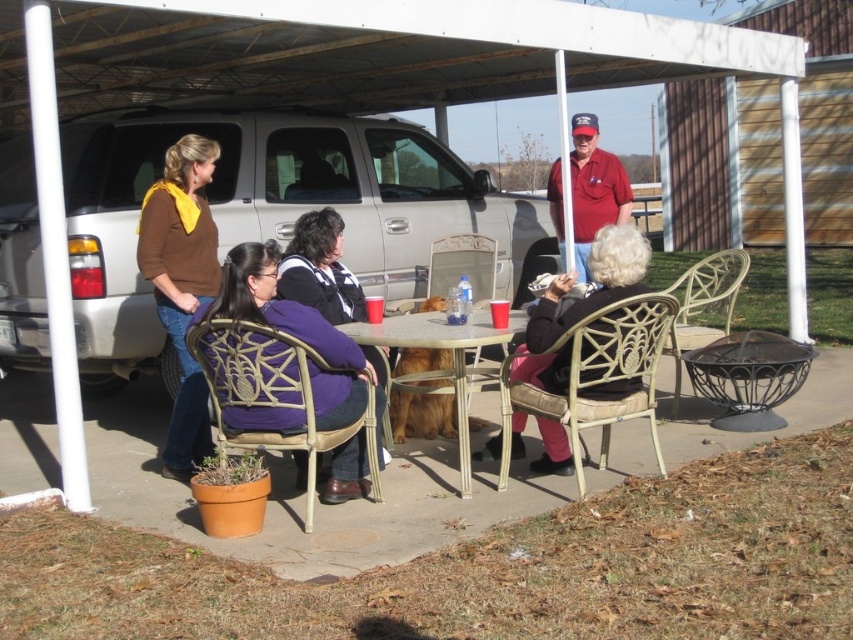
Question: Which point appears closest to the camera in this image?

Choices:
 (A) (279, 262)
 (B) (637, 376)

Answer: (B)

Question: Does metallic gold chair at center have a greater width compared to red cotton shirt at center?

Choices:
 (A) yes
 (B) no

Answer: (A)

Question: Which of these objects is positioned farthest from the metallic gold chair at right?

Choices:
 (A) silver metallic suv at center
 (B) purple sweater at center

Answer: (A)

Question: Is brown sweater at left bigger than metallic gold chair at right?

Choices:
 (A) no
 (B) yes

Answer: (A)

Question: From the image, what is the correct spatial relationship of matte white chair at lower center in relation to brown sweater at left?

Choices:
 (A) right
 (B) left

Answer: (A)

Question: Among these objects, which one is nearest to the camera?

Choices:
 (A) matte white chair at lower center
 (B) purple sweater at center

Answer: (A)